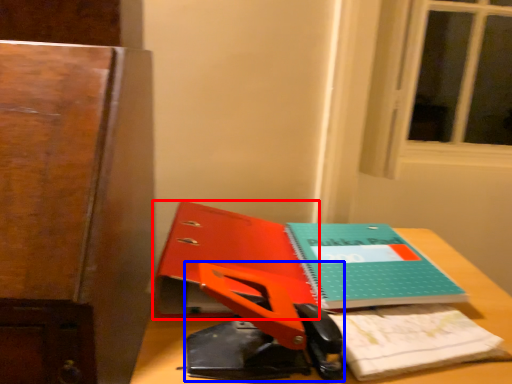
Question: Which object is closer to the camera taking this photo, paperback book (highlighted by a red box) or scissors (highlighted by a blue box)?

Choices:
 (A) paperback book
 (B) scissors

Answer: (B)